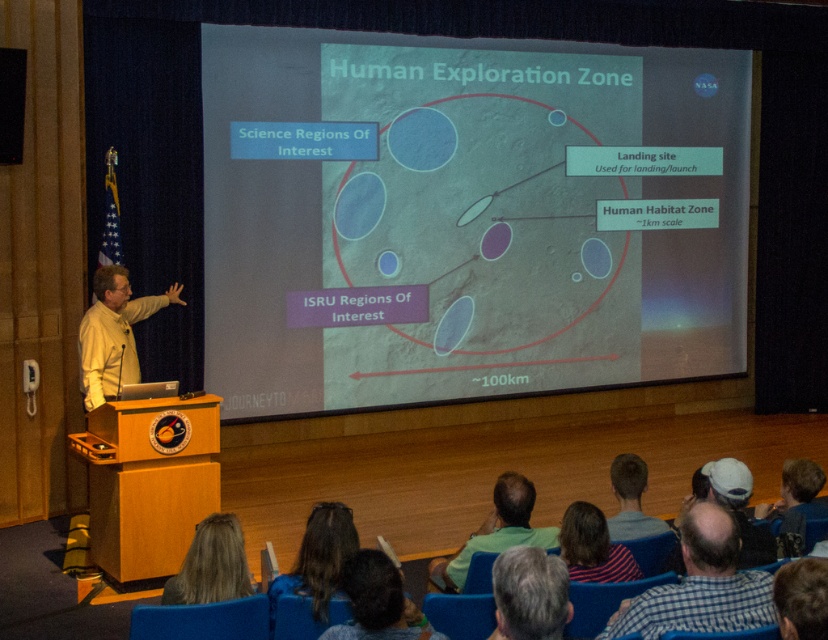
From the picture: Who is shorter, checkered fabric shirt at lower right or dark brown hair at lower center?

dark brown hair at lower center is shorter.

Who is taller, checkered fabric shirt at lower right or dark brown hair at lower center?

checkered fabric shirt at lower right

Is point (716, 509) positioned behind point (301, 550)?

No, it is in front of (301, 550).

Identify the location of checkered fabric shirt at lower right. (700, 586).

Is yellow matte shirt at left positioned in front of dark brown hair at lower center?

No, yellow matte shirt at left is behind dark brown hair at lower center.

Does yellow matte shirt at left appear over dark brown hair at lower center?

Yes, yellow matte shirt at left is above dark brown hair at lower center.

Is point (124, 353) closer to camera compared to point (278, 579)?

No, it is behind (278, 579).

Identify the location of yellow matte shirt at left. (113, 333).

Is dark brown hair at lower center wider than white matte cap at lower center?

Correct, the width of dark brown hair at lower center exceeds that of white matte cap at lower center.

At what (x,y) coordinates should I click in order to perform the action: click on dark brown hair at lower center. Please return your answer as a coordinate pair (x, y). Looking at the image, I should click on pyautogui.click(x=318, y=560).

The height and width of the screenshot is (640, 828). Identify the location of dark brown hair at lower center. (318, 560).